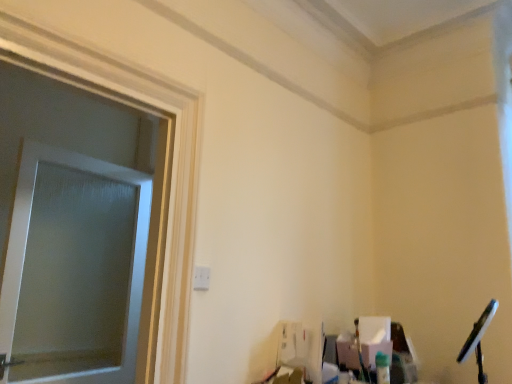
What is the approximate width of frosted glass window screen at left?

1.71 inches.

At what (x,y) coordinates should I click in order to perform the action: click on frosted glass window screen at left. Please return your answer as a coordinate pair (x, y). The height and width of the screenshot is (384, 512). Looking at the image, I should click on (76, 277).

In order to face frosted glass window screen at left, should I rotate leftwards or rightwards?

Rotate your view left by about 22.505°.

The image size is (512, 384). What do you see at coordinates (76, 277) in the screenshot?
I see `frosted glass window screen at left` at bounding box center [76, 277].

This screenshot has height=384, width=512. Identify the location of white wood frame at left. (172, 159).

What do you see at coordinates (172, 159) in the screenshot? I see `white wood frame at left` at bounding box center [172, 159].

Find the location of a particular element. The height and width of the screenshot is (384, 512). frosted glass window screen at left is located at coordinates (76, 277).

Can you confirm if frosted glass window screen at left is positioned to the left of white wood frame at left?

Yes, frosted glass window screen at left is to the left of white wood frame at left.

From the picture: Which object is further away from the camera taking this photo, frosted glass window screen at left or white wood frame at left?

Positioned behind is frosted glass window screen at left.

Is point (49, 336) positioned before point (155, 79)?

No, (49, 336) is further to viewer.

From the image's perspective, which one is positioned higher, frosted glass window screen at left or white wood frame at left?

white wood frame at left.

From a real-world perspective, is frosted glass window screen at left above or below white wood frame at left?

From a real-world perspective, frosted glass window screen at left is physically below white wood frame at left.

Can you confirm if frosted glass window screen at left is wider than white wood frame at left?

Incorrect, the width of frosted glass window screen at left does not surpass that of white wood frame at left.

Is frosted glass window screen at left taller than white wood frame at left?

No.

Does frosted glass window screen at left have a larger size compared to white wood frame at left?

No.

Is frosted glass window screen at left spatially inside white wood frame at left, or outside of it?

frosted glass window screen at left cannot be found inside white wood frame at left.

Is frosted glass window screen at left far from white wood frame at left?

Yes, frosted glass window screen at left and white wood frame at left are located far from each other.

Could you tell me if frosted glass window screen at left is facing white wood frame at left?

Yes, frosted glass window screen at left is oriented towards white wood frame at left.

What's the angular difference between frosted glass window screen at left and white wood frame at left's facing directions?

They differ by 1.22 degrees in their facing directions.

This screenshot has height=384, width=512. What are the coordinates of `window frame located above the frosted glass window screen at left (from a real-world perspective)` in the screenshot? It's located at (172, 159).

Considering the relative positions of white wood frame at left and frosted glass window screen at left in the image provided, is white wood frame at left to the left or to the right of frosted glass window screen at left?

white wood frame at left is to the right of frosted glass window screen at left.

Is white wood frame at left behind frosted glass window screen at left?

No, it is in front of frosted glass window screen at left.

Is point (12, 14) positioned after point (98, 347)?

No, it is in front of (98, 347).

From the image's perspective, which one is positioned higher, white wood frame at left or frosted glass window screen at left?

white wood frame at left, from the image's perspective.

In the scene shown: From a real-world perspective, does white wood frame at left stand above frosted glass window screen at left?

Indeed, from a real-world perspective, white wood frame at left stands above frosted glass window screen at left.

Which of these two, white wood frame at left or frosted glass window screen at left, is thinner?

frosted glass window screen at left is thinner.

Considering the relative sizes of white wood frame at left and frosted glass window screen at left in the image provided, is white wood frame at left taller than frosted glass window screen at left?

Correct, white wood frame at left is much taller as frosted glass window screen at left.

Which of these two, white wood frame at left or frosted glass window screen at left, is smaller?

Smaller between the two is frosted glass window screen at left.

Is white wood frame at left outside of frosted glass window screen at left?

Yes, white wood frame at left is outside of frosted glass window screen at left.

Are white wood frame at left and frosted glass window screen at left located far from each other?

white wood frame at left is positioned a significant distance from frosted glass window screen at left.

Is white wood frame at left oriented towards frosted glass window screen at left?

No, white wood frame at left does not turn towards frosted glass window screen at left.

What's the angular difference between white wood frame at left and frosted glass window screen at left's facing directions?

The angle between the facing direction of white wood frame at left and the facing direction of frosted glass window screen at left is 1.22 degrees.

Find the location of `window screen below the white wood frame at left (from a real-world perspective)`. window screen below the white wood frame at left (from a real-world perspective) is located at coordinates (76, 277).

You are a GUI agent. You are given a task and a screenshot of the screen. Output one action in this format:
    pyautogui.click(x=<x>, y=<y>)
    Task: Click on the window frame in front of the frosted glass window screen at left
    Image resolution: width=512 pixels, height=384 pixels.
    Given the screenshot: What is the action you would take?
    pyautogui.click(x=172, y=159)

This screenshot has width=512, height=384. I want to click on window frame on the right of frosted glass window screen at left, so click(172, 159).